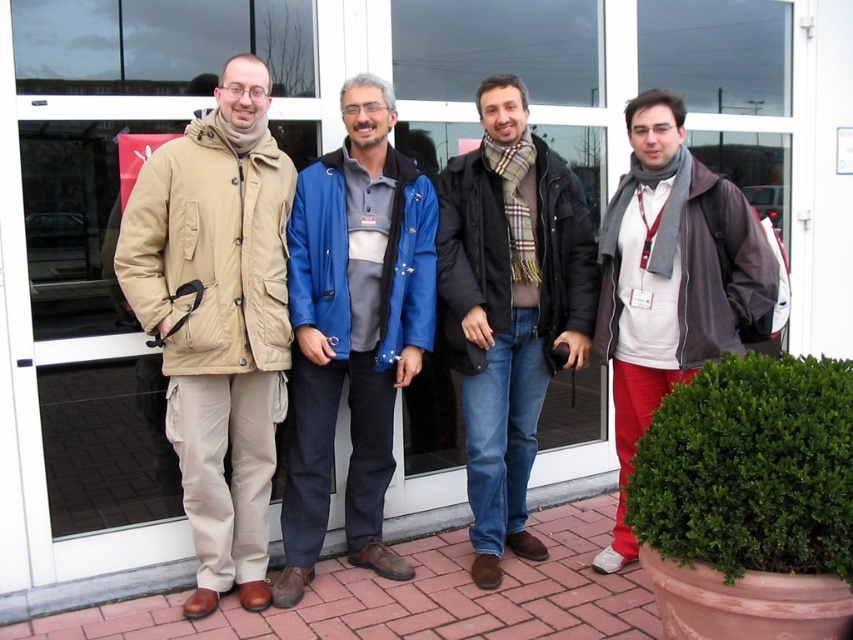
Question: Which of the following is the closest to the observer?

Choices:
 (A) (231, 352)
 (B) (357, 513)
 (C) (485, 410)

Answer: (A)

Question: Estimate the real-world distances between objects in this image. Which object is farther from the beige fabric coat at left?

Choices:
 (A) gray wool scarf at right
 (B) blue fabric jacket at center

Answer: (A)

Question: Which of the following is the closest to the observer?

Choices:
 (A) (279, 369)
 (B) (733, 252)
 (C) (404, 301)

Answer: (B)

Question: Is beige fabric coat at left above plaid scarf at center?

Choices:
 (A) no
 (B) yes

Answer: (A)

Question: Can you confirm if blue fabric jacket at center is thinner than plaid scarf at center?

Choices:
 (A) no
 (B) yes

Answer: (B)

Question: Is plaid scarf at center smaller than gray wool scarf at right?

Choices:
 (A) no
 (B) yes

Answer: (B)